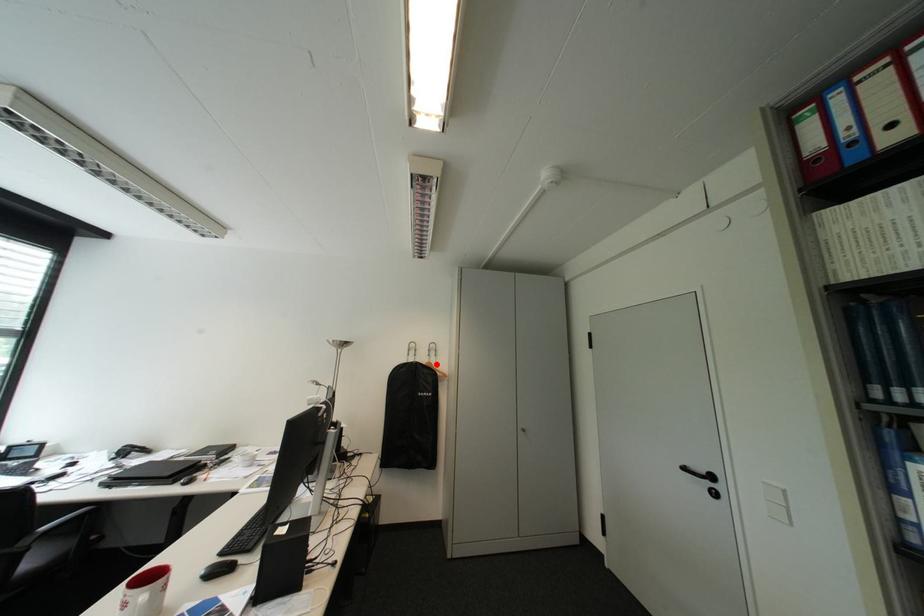
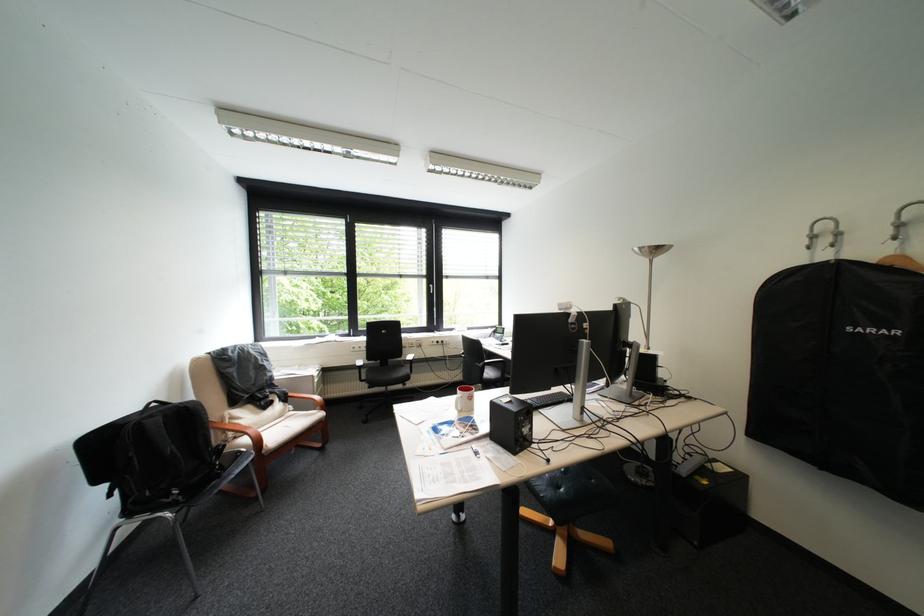
Find the pixel in the second image that matches the highlighted location in the first image.

(886, 262)